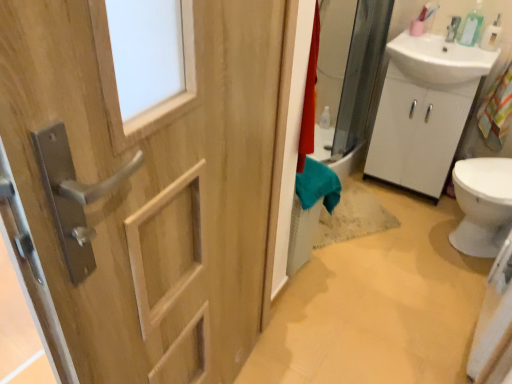
Question: Does natural wood door at left have a lesser width compared to clear plastic soap dispenser at upper right?

Choices:
 (A) no
 (B) yes

Answer: (A)

Question: Is clear plastic soap dispenser at upper right inside natural wood door at left?

Choices:
 (A) yes
 (B) no

Answer: (B)

Question: Considering the relative sizes of natural wood door at left and clear plastic soap dispenser at upper right in the image provided, is natural wood door at left bigger than clear plastic soap dispenser at upper right?

Choices:
 (A) no
 (B) yes

Answer: (B)

Question: Can you confirm if natural wood door at left is taller than clear plastic soap dispenser at upper right?

Choices:
 (A) yes
 (B) no

Answer: (A)

Question: From a real-world perspective, is natural wood door at left over clear plastic soap dispenser at upper right?

Choices:
 (A) no
 (B) yes

Answer: (A)

Question: From the image's perspective, relative to natural wood door at left, is white matte cabinet at right above or below?

Choices:
 (A) above
 (B) below

Answer: (A)

Question: From a real-world perspective, relative to natural wood door at left, is white matte cabinet at right vertically above or below?

Choices:
 (A) below
 (B) above

Answer: (A)

Question: Considering the positions of white matte cabinet at right and natural wood door at left in the image, is white matte cabinet at right bigger or smaller than natural wood door at left?

Choices:
 (A) big
 (B) small

Answer: (A)

Question: Is white matte cabinet at right spatially inside natural wood door at left, or outside of it?

Choices:
 (A) outside
 (B) inside

Answer: (A)

Question: In terms of size, does clear plastic soap dispenser at upper right appear bigger or smaller than natural wood door at left?

Choices:
 (A) small
 (B) big

Answer: (A)

Question: Visually, is clear plastic soap dispenser at upper right positioned to the left or to the right of natural wood door at left?

Choices:
 (A) left
 (B) right

Answer: (B)

Question: Is point (473, 28) closer or farther from the camera than point (64, 107)?

Choices:
 (A) farther
 (B) closer

Answer: (A)

Question: Relative to natural wood door at left, is clear plastic soap dispenser at upper right in front or behind?

Choices:
 (A) front
 (B) behind

Answer: (B)

Question: Considering the positions of natural wood door at left and clear plastic soap dispenser at upper right in the image, is natural wood door at left wider or thinner than clear plastic soap dispenser at upper right?

Choices:
 (A) thin
 (B) wide

Answer: (B)

Question: From a real-world perspective, is natural wood door at left physically located above or below clear plastic soap dispenser at upper right?

Choices:
 (A) above
 (B) below

Answer: (B)